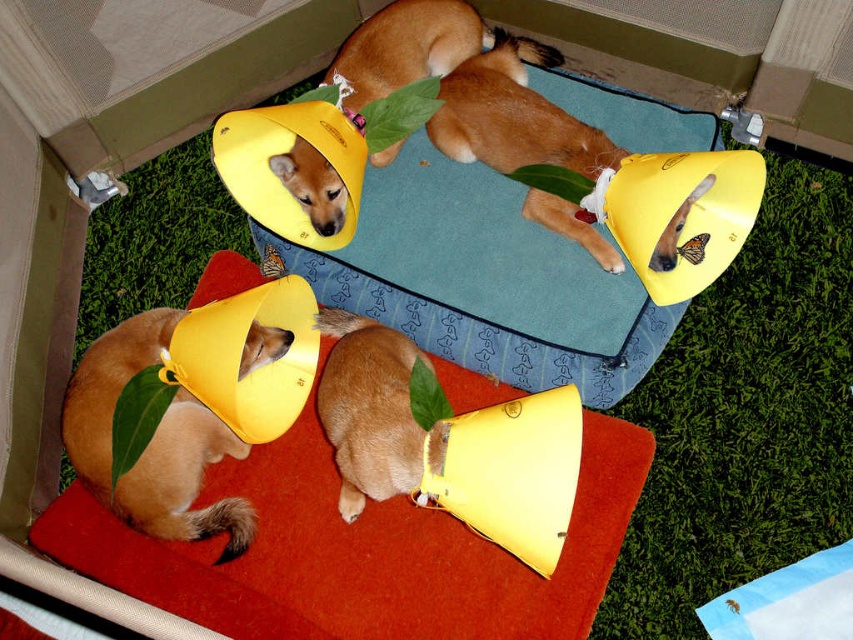
You are a pet owner trying to move your golden fur dog at lower left to the soft orange carpet at lower center. Can the dog fit on the carpet without overlapping the edges?

The soft orange carpet at lower center has a larger width than the golden fur dog at lower left, so the dog can fit on the carpet without overlapping the edges.

You are a dog owner who wants to place a new toy on the soft orange carpet at lower center without it overlapping the matte yellow cone at center. Given the size difference between them, can you fit the toy on the carpet?

The soft orange carpet at lower center is bigger than the matte yellow cone at center, so yes, you can place the toy on the soft orange carpet at lower center without overlapping the matte yellow cone at center since the carpet is larger in size.